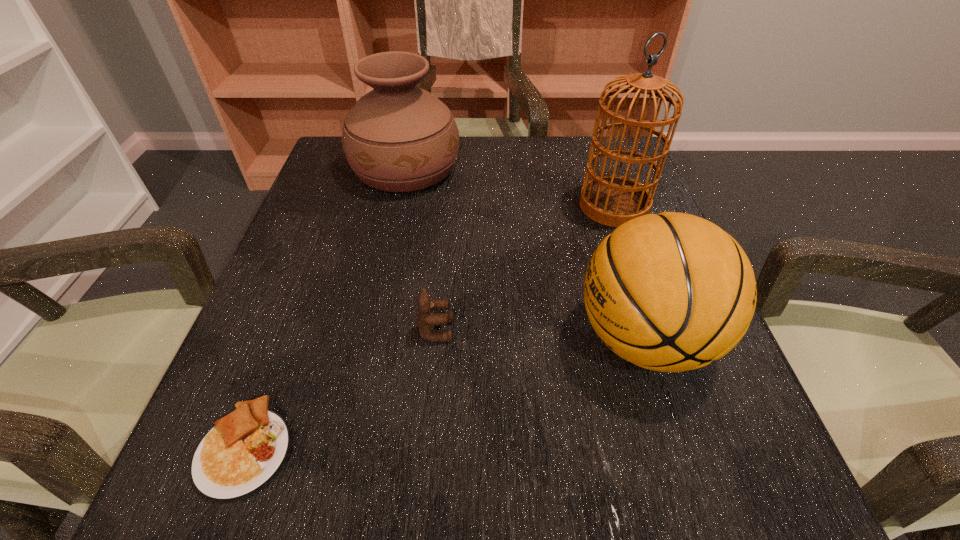
The width and height of the screenshot is (960, 540). What are the coordinates of `free region located 0.120m on the face of the teddy bear` in the screenshot? It's located at (524, 330).

Locate an element on the screen. vacant space located on the right of the omelet is located at coordinates (586, 448).

Where is `birdcage that is at the far edge`? birdcage that is at the far edge is located at coordinates (612, 200).

You are a GUI agent. You are given a task and a screenshot of the screen. Output one action in this format:
    pyautogui.click(x=<x>, y=<y>)
    Task: Click on the urn that is at the far edge
    This screenshot has height=540, width=960.
    Given the screenshot: What is the action you would take?
    [398, 137]

This screenshot has width=960, height=540. What are the coordinates of `object located in the near edge section of the desktop` in the screenshot? It's located at (238, 457).

Find the location of a particular element. This screenshot has width=960, height=540. urn present at the left edge is located at coordinates (398, 137).

I want to click on omelet present at the left edge, so click(238, 457).

At what (x,y) coordinates should I click in order to perform the action: click on birdcage that is at the right edge. Please return your answer as a coordinate pair (x, y). Looking at the image, I should click on (612, 200).

At what (x,y) coordinates should I click in order to perform the action: click on basketball situated at the right edge. Please return your answer as a coordinate pair (x, y). The image size is (960, 540). Looking at the image, I should click on (671, 292).

The width and height of the screenshot is (960, 540). I want to click on object present at the far left corner, so click(398, 137).